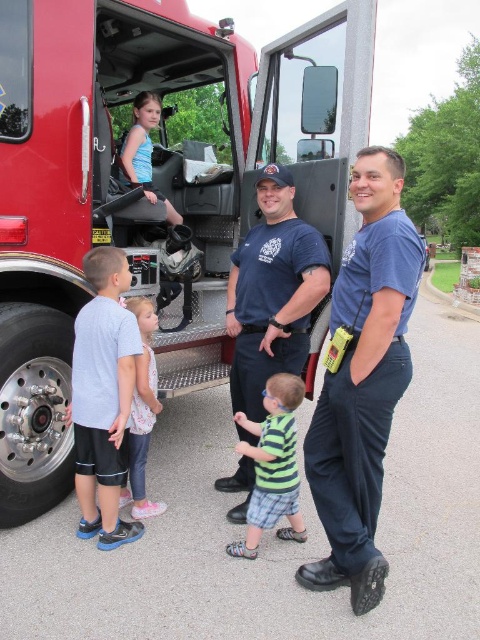
The height and width of the screenshot is (640, 480). What do you see at coordinates (103, 397) in the screenshot? I see `gray matte shorts at lower left` at bounding box center [103, 397].

Looking at this image, who is shorter, gray matte shorts at lower left or pink fabric dress at lower left?

With less height is pink fabric dress at lower left.

Between point (139, 333) and point (152, 419), which one is positioned in front?

Point (139, 333) is in front.

Find the location of a particular element. gray matte shorts at lower left is located at coordinates (103, 397).

Is blue cotton shirt at center above green striped shirt at center?

Correct, blue cotton shirt at center is located above green striped shirt at center.

Who is higher up, blue cotton shirt at center or green striped shirt at center?

blue cotton shirt at center is above.

Who is more forward, (313, 296) or (274, 509)?

Positioned in front is point (274, 509).

Find the location of a particular element. This screenshot has height=640, width=480. blue cotton shirt at center is located at coordinates (273, 292).

Is green striped shirt at center thinner than pink fabric dress at lower left?

In fact, green striped shirt at center might be wider than pink fabric dress at lower left.

Does green striped shirt at center appear on the right side of pink fabric dress at lower left?

Indeed, green striped shirt at center is positioned on the right side of pink fabric dress at lower left.

What do you see at coordinates (273, 465) in the screenshot? I see `green striped shirt at center` at bounding box center [273, 465].

Locate an element on the screen. green striped shirt at center is located at coordinates (273, 465).